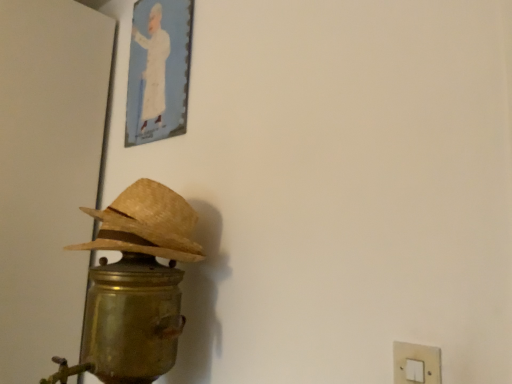
Question: Considering the relative sizes of white plastic light switch at lower right and gold metallic table lamp at left in the image provided, is white plastic light switch at lower right wider than gold metallic table lamp at left?

Choices:
 (A) yes
 (B) no

Answer: (B)

Question: Is white plastic light switch at lower right not close to gold metallic table lamp at left?

Choices:
 (A) no
 (B) yes

Answer: (A)

Question: Is white plastic light switch at lower right shorter than gold metallic table lamp at left?

Choices:
 (A) no
 (B) yes

Answer: (B)

Question: Is white plastic light switch at lower right behind gold metallic table lamp at left?

Choices:
 (A) no
 (B) yes

Answer: (A)

Question: Is white plastic light switch at lower right aimed at gold metallic table lamp at left?

Choices:
 (A) no
 (B) yes

Answer: (A)

Question: Considering the positions of braided straw hat at left and white plastic light switch at lower right in the image, is braided straw hat at left wider or thinner than white plastic light switch at lower right?

Choices:
 (A) thin
 (B) wide

Answer: (B)

Question: Which is correct: braided straw hat at left is inside white plastic light switch at lower right, or outside of it?

Choices:
 (A) outside
 (B) inside

Answer: (A)

Question: From a real-world perspective, relative to white plastic light switch at lower right, is braided straw hat at left vertically above or below?

Choices:
 (A) above
 (B) below

Answer: (A)

Question: Visually, is braided straw hat at left positioned to the left or to the right of white plastic light switch at lower right?

Choices:
 (A) right
 (B) left

Answer: (B)

Question: Is point (420, 364) positioned closer to the camera than point (118, 322)?

Choices:
 (A) closer
 (B) farther

Answer: (A)

Question: Is white plastic light switch at lower right in front of or behind gold metallic table lamp at left in the image?

Choices:
 (A) front
 (B) behind

Answer: (A)

Question: Do you think white plastic light switch at lower right is within gold metallic table lamp at left, or outside of it?

Choices:
 (A) outside
 (B) inside

Answer: (A)

Question: From a real-world perspective, is white plastic light switch at lower right physically located above or below gold metallic table lamp at left?

Choices:
 (A) below
 (B) above

Answer: (A)

Question: Looking at their shapes, would you say gold metallic table lamp at left is wider or thinner than braided straw hat at left?

Choices:
 (A) thin
 (B) wide

Answer: (B)

Question: Considering the positions of point (83, 327) and point (160, 210), is point (83, 327) closer or farther from the camera than point (160, 210)?

Choices:
 (A) farther
 (B) closer

Answer: (B)